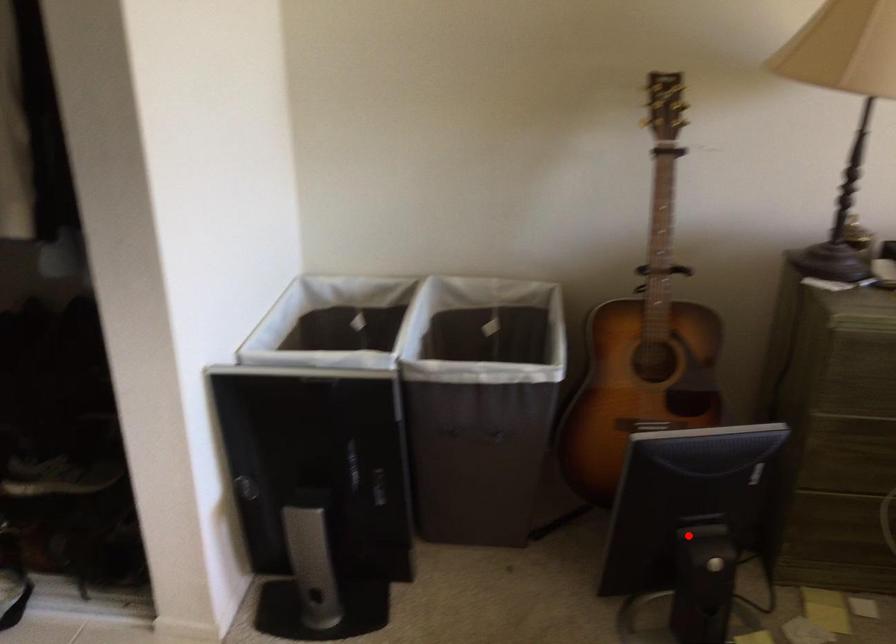
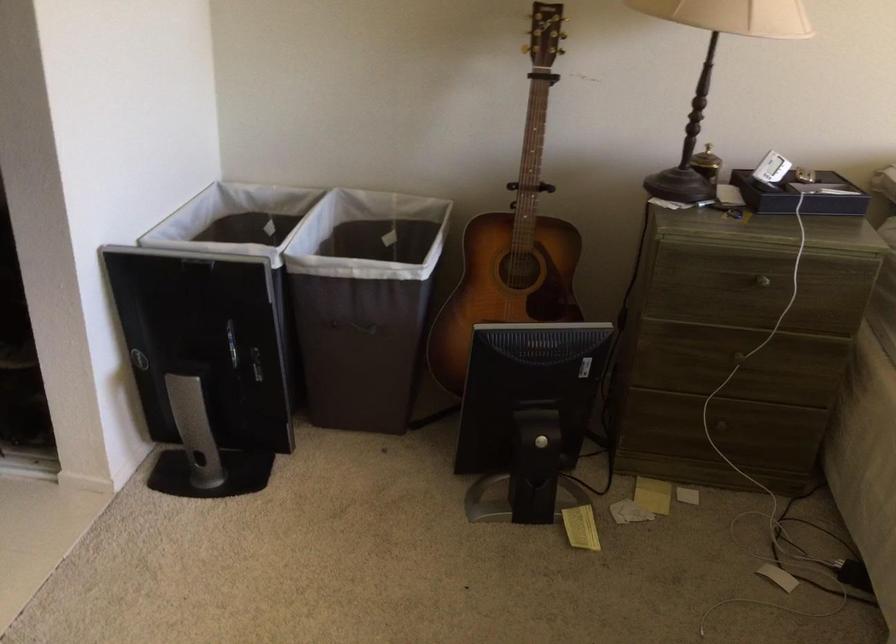
Question: A red point is marked in image1. In image2, is the corresponding 3D point closer to the camera or farther? Reply with the corresponding letter.

Choices:
 (A) The corresponding 3D point is closer.
 (B) The corresponding 3D point is farther.

Answer: (B)